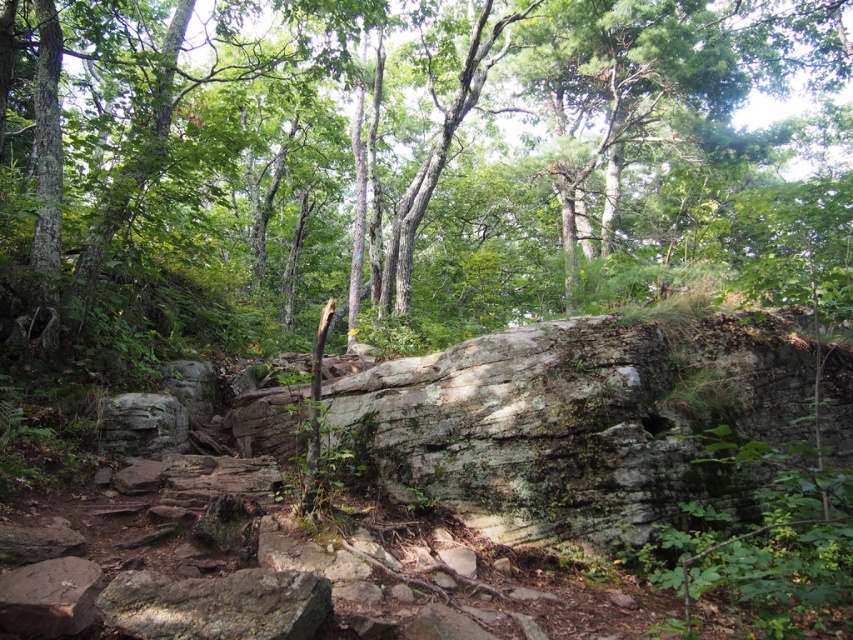
Measure the distance from gray/rough rock at center to green mossy rock at lower left.

2.55 meters

Does gray/rough rock at center appear on the right side of green mossy rock at lower left?

Indeed, gray/rough rock at center is positioned on the right side of green mossy rock at lower left.

Is point (598, 449) positioned behind point (317, 616)?

Yes, point (598, 449) is behind point (317, 616).

Find the location of a particular element. The width and height of the screenshot is (853, 640). gray/rough rock at center is located at coordinates (573, 422).

Does smooth gray rock at center appear on the left side of gray/rough rock at center?

Yes, smooth gray rock at center is to the left of gray/rough rock at center.

Does smooth gray rock at center lie in front of gray/rough rock at center?

No.

Measure the distance between point (x=241, y=170) and camera.

Point (x=241, y=170) is 58.92 feet away from camera.

Locate an element on the screen. This screenshot has width=853, height=640. smooth gray rock at center is located at coordinates (405, 164).

Describe the element at coordinates (405, 164) in the screenshot. I see `smooth gray rock at center` at that location.

Looking at this image, does smooth gray rock at center appear on the right side of green mossy rock at lower left?

Yes, smooth gray rock at center is to the right of green mossy rock at lower left.

Between point (834, 182) and point (206, 586), which one is positioned behind?

Point (834, 182)

At what (x,y) coordinates should I click in order to perform the action: click on smooth gray rock at center. Please return your answer as a coordinate pair (x, y). This screenshot has width=853, height=640. Looking at the image, I should click on (405, 164).